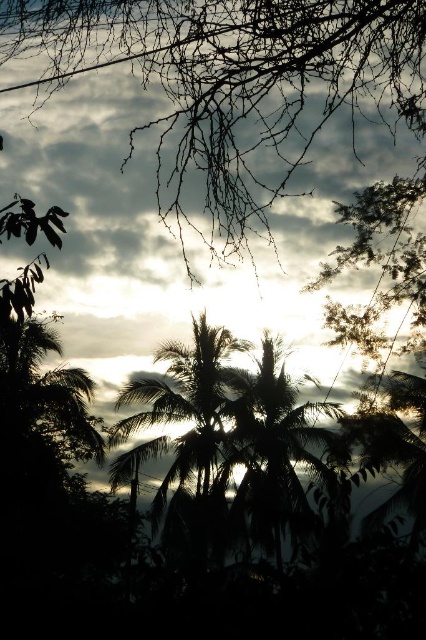
Does silhouette leafy palm at center have a lesser width compared to silhouette palm tree at center?

In fact, silhouette leafy palm at center might be wider than silhouette palm tree at center.

Locate an element on the screen. The height and width of the screenshot is (640, 426). silhouette leafy palm at center is located at coordinates (270, 458).

In the scene shown: Measure the distance between cloudy sky at upper center and silhouette leafy palm at center.

cloudy sky at upper center is 12.17 meters from silhouette leafy palm at center.

Is point (141, 44) positioned before point (262, 465)?

That is True.

Which is in front, point (250, 70) or point (262, 433)?

Point (250, 70) is in front.

Locate an element on the screen. cloudy sky at upper center is located at coordinates (233, 84).

Based on the photo, who is positioned more to the left, cloudy sky at upper center or silhouette palm tree at center?

Positioned to the left is silhouette palm tree at center.

Does cloudy sky at upper center have a larger size compared to silhouette palm tree at center?

Actually, cloudy sky at upper center might be smaller than silhouette palm tree at center.

Where is `cloudy sky at upper center`? This screenshot has height=640, width=426. cloudy sky at upper center is located at coordinates (233, 84).

This screenshot has width=426, height=640. What are the coordinates of `cloudy sky at upper center` in the screenshot? It's located at (233, 84).